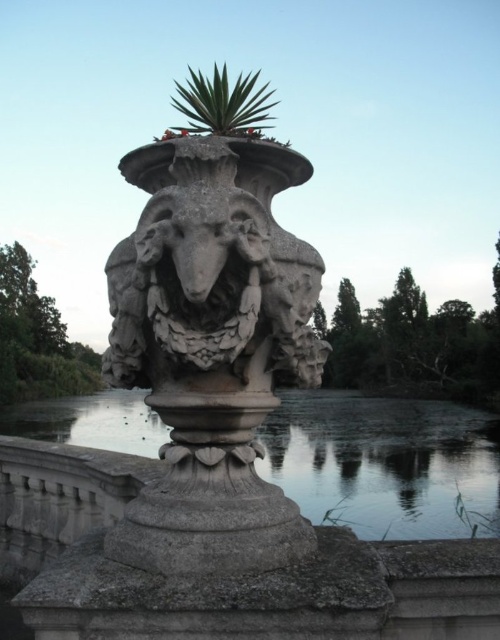
Question: Estimate the real-world distances between objects in this image. Which object is closer to the green leafy plant at top?

Choices:
 (A) green leafy plant at center
 (B) transparent water at base center

Answer: (A)

Question: Is transparent water at base center thinner than green leafy plant at center?

Choices:
 (A) no
 (B) yes

Answer: (A)

Question: Which point is closer to the camera?

Choices:
 (A) green leafy plant at center
 (B) transparent water at base center
 (C) green leafy plant at top

Answer: (C)

Question: Among these points, which one is farthest from the camera?

Choices:
 (A) (494, 497)
 (B) (176, 84)

Answer: (B)

Question: In this image, where is green leafy plant at top located relative to green leafy plant at center?

Choices:
 (A) below
 (B) above

Answer: (B)

Question: Is green leafy plant at top closer to the viewer compared to green leafy plant at center?

Choices:
 (A) yes
 (B) no

Answer: (A)